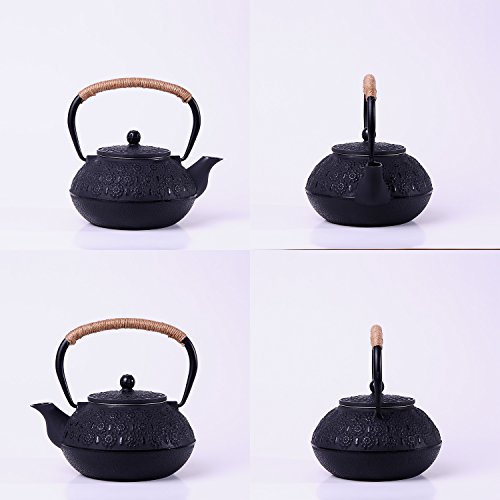
Locate an element on the screen. bottom of kettle is located at coordinates (337, 212), (154, 213), (156, 460), (355, 470).